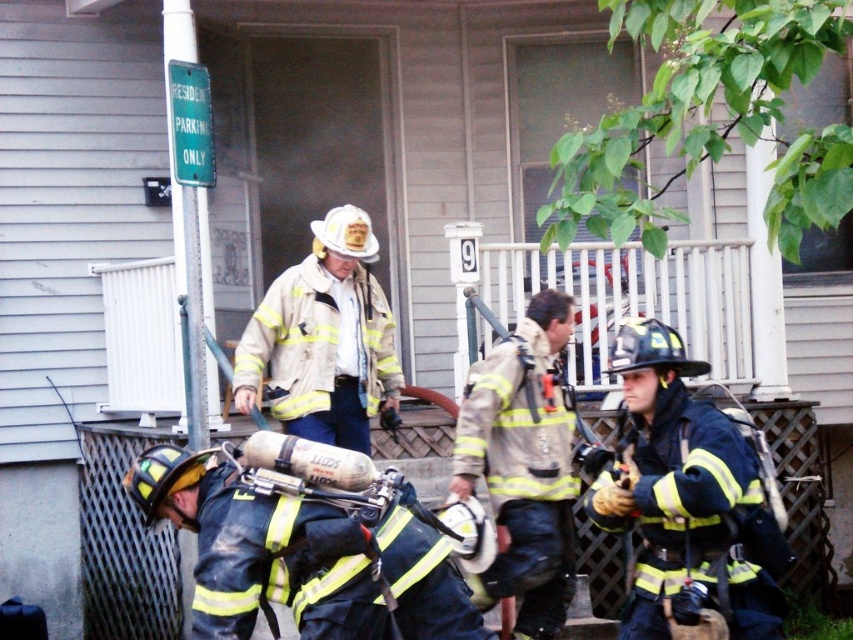
Find the location of `dark blue uniform at center`. dark blue uniform at center is located at coordinates (688, 502).

The image size is (853, 640). What do you see at coordinates (688, 502) in the screenshot? I see `dark blue uniform at center` at bounding box center [688, 502].

Locate an element on the screen. Image resolution: width=853 pixels, height=640 pixels. dark blue uniform at center is located at coordinates (688, 502).

Can you confirm if dark blue uniform at center is thinner than white matte helmet at center?

Indeed, dark blue uniform at center has a lesser width compared to white matte helmet at center.

Can you confirm if dark blue uniform at center is smaller than white matte helmet at center?

Yes.

Which is in front, point (601, 525) or point (334, 308)?

Point (601, 525)

Locate an element on the screen. Image resolution: width=853 pixels, height=640 pixels. dark blue uniform at center is located at coordinates (688, 502).

Who is positioned more to the left, reflective black fireman at lower left or white matte helmet at center?

white matte helmet at center is more to the left.

Is reflective black fireman at lower left shorter than white matte helmet at center?

Yes.

Which is in front, point (222, 556) or point (242, 388)?

Point (222, 556) is in front.

Locate an element on the screen. Image resolution: width=853 pixels, height=640 pixels. reflective black fireman at lower left is located at coordinates (302, 556).